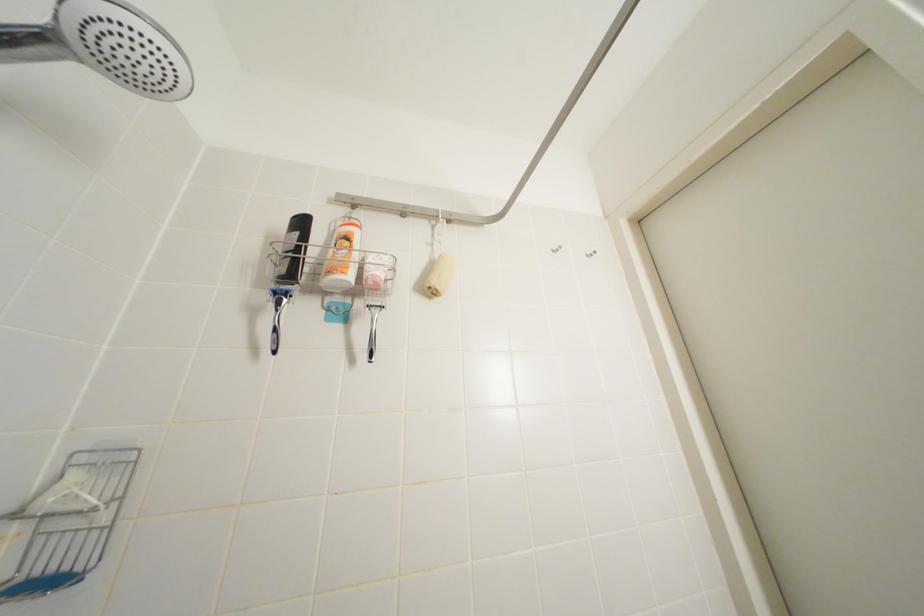
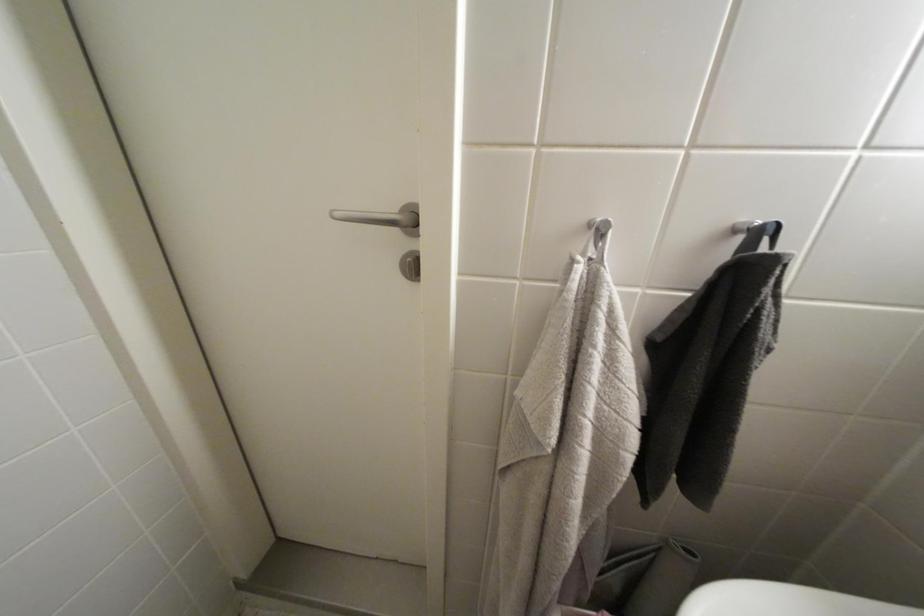
The images are taken continuously from a first-person perspective. In which direction is your viewpoint rotating?

The rotation direction of the camera is right-down.